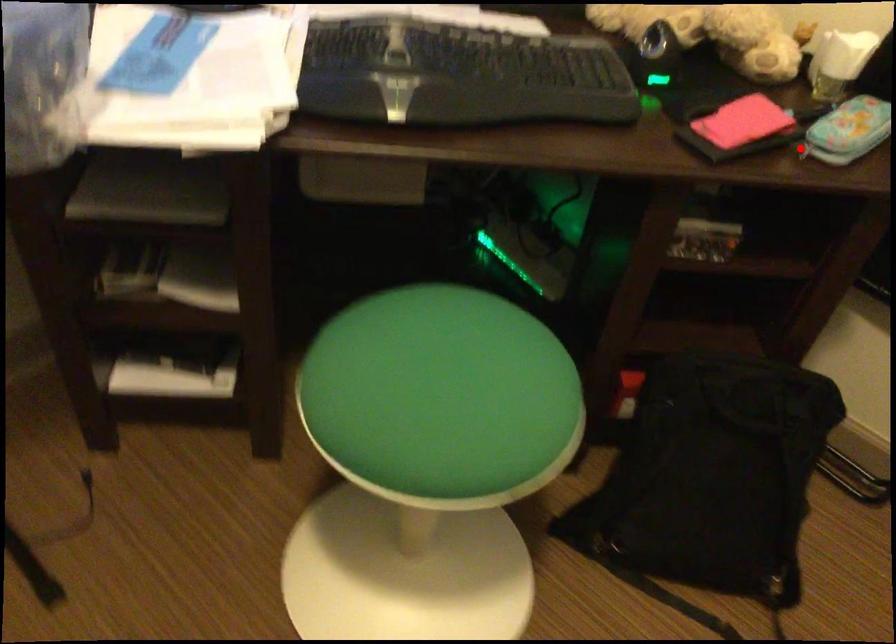
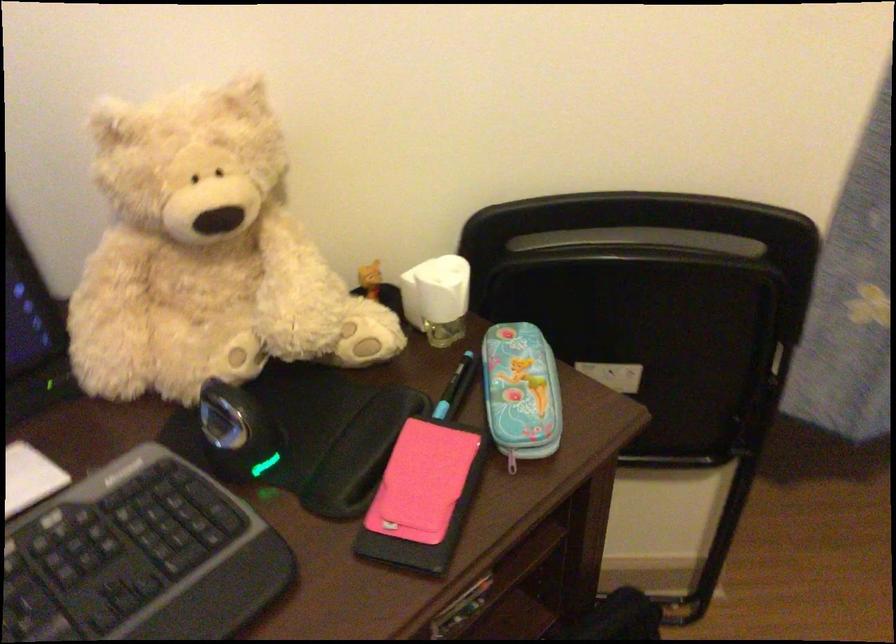
Locate, in the second image, the point that corresponds to the highlighted location in the first image.

(512, 460)